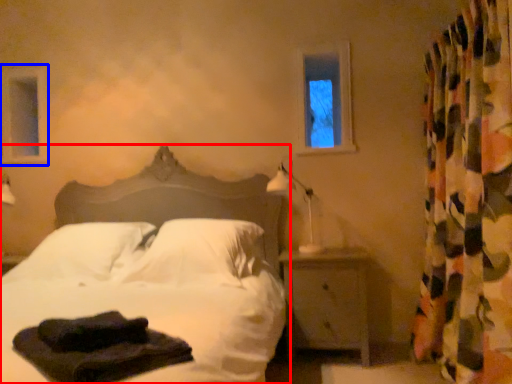
Question: Which of the following is the farthest to the observer, bed (highlighted by a red box) or window frame (highlighted by a blue box)?

Choices:
 (A) bed
 (B) window frame

Answer: (B)